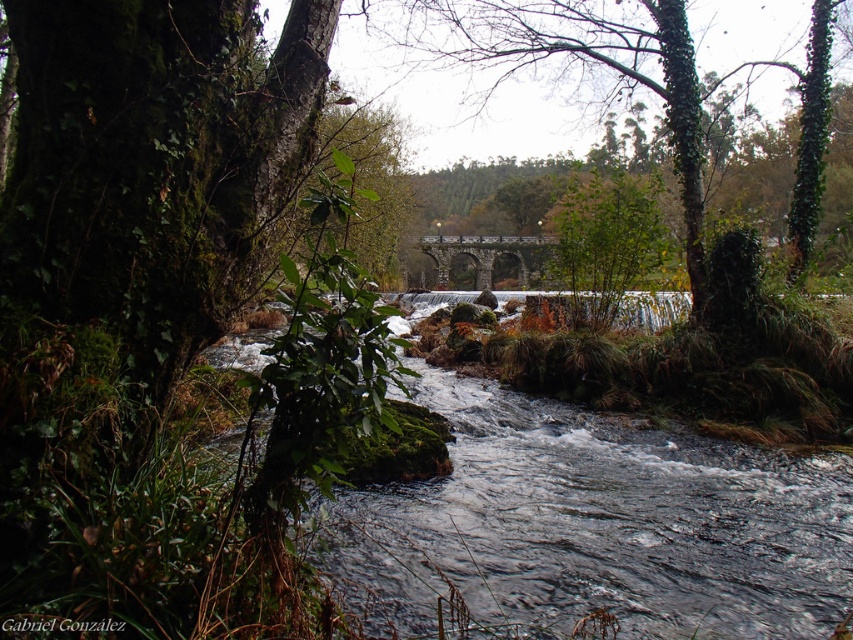
You are standing at the edge of the river and want to cross to the other side. There is a stone arch bridge at center and clear water at center. Which one is closer to you?

The clear water at center is 30.46 meters away from the stone arch bridge at center. Since both are at the center, they are equidistant from your current position at the river edge, so neither is closer.

You are a hiker who wants to cross the river using the stone arch bridge at center. However, you notice the green leafy tree at center nearby. Does the tree block your path to the bridge?

The green leafy tree at center is larger than the stone arch bridge at center, so it might block the path to the bridge depending on its exact position relative to the bridge.